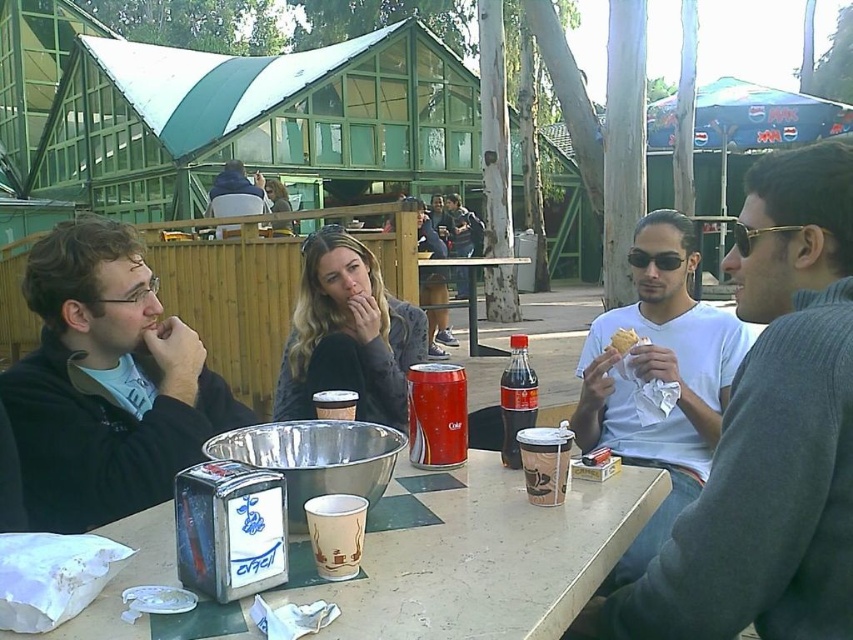
The image size is (853, 640). Find the location of `black plastic sunglasses at center`. black plastic sunglasses at center is located at coordinates (654, 259).

Does black plastic sunglasses at center have a larger size compared to golden flaky pastry at right?

Yes.

You are a GUI agent. You are given a task and a screenshot of the screen. Output one action in this format:
    pyautogui.click(x=<x>, y=<y>)
    Task: Click on the black plastic sunglasses at center
    Image resolution: width=853 pixels, height=640 pixels.
    Given the screenshot: What is the action you would take?
    (654, 259)

Can you confirm if metallic silver table at center is wider than dark blue jacket at center?

Indeed, metallic silver table at center has a greater width compared to dark blue jacket at center.

What do you see at coordinates (469, 292) in the screenshot? I see `metallic silver table at center` at bounding box center [469, 292].

Where is `metallic silver table at center`? metallic silver table at center is located at coordinates (469, 292).

Which is in front, point (91, 397) or point (488, 352)?

Point (91, 397) is in front.

Who is positioned more to the right, black matte jacket at left or metallic silver table at center?

Positioned to the right is metallic silver table at center.

Where is `black matte jacket at left`? The image size is (853, 640). black matte jacket at left is located at coordinates (106, 381).